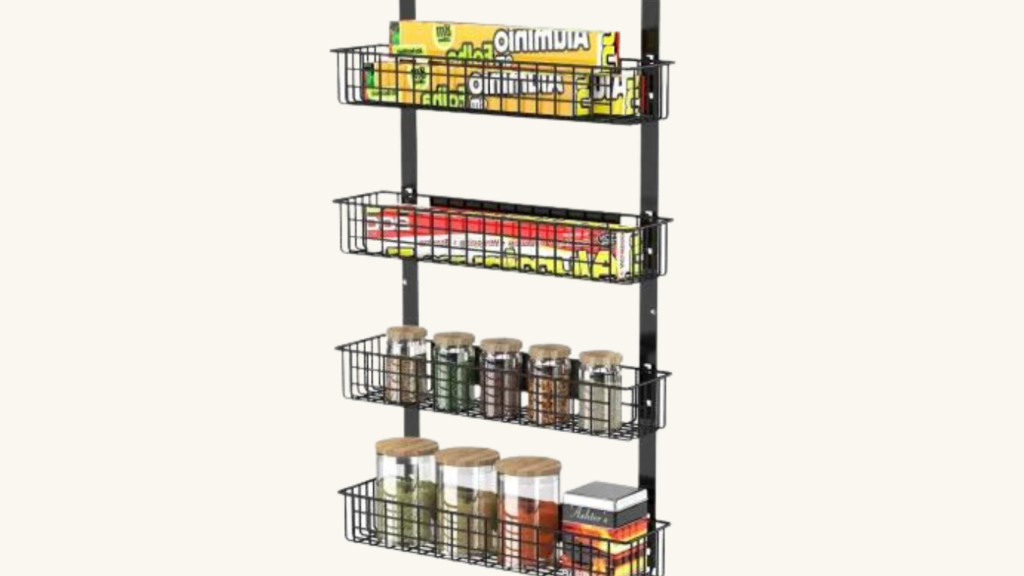
Locate an element on the screen. Image resolution: width=1024 pixels, height=576 pixels. bottom shelf is located at coordinates (467, 528).